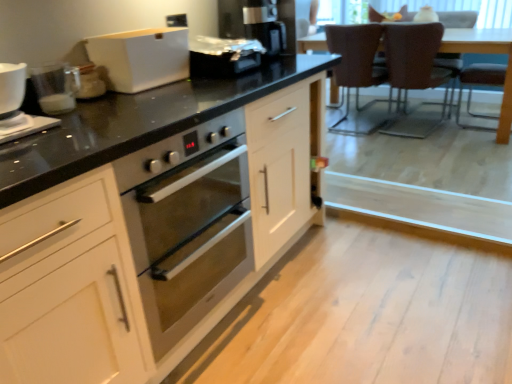
Question: Is brown leather armchair at right, placed as the 1th armchair when sorted from front to back, taller than brown leather armchair at upper right, marked as the 1th armchair in a back-to-front arrangement?

Choices:
 (A) yes
 (B) no

Answer: (B)

Question: Is brown leather armchair at right, positioned as the 2th armchair in back-to-front order, facing away from brown leather armchair at upper right, marked as the 1th armchair in a back-to-front arrangement?

Choices:
 (A) no
 (B) yes

Answer: (A)

Question: Is the depth of brown leather armchair at right, positioned as the 2th armchair in back-to-front order, greater than that of brown leather armchair at upper right, which is counted as the second armchair, starting from the front?

Choices:
 (A) no
 (B) yes

Answer: (A)

Question: Could you tell me if brown leather armchair at right, positioned as the 2th armchair in back-to-front order, is turned towards brown leather armchair at upper right, marked as the 1th armchair in a back-to-front arrangement?

Choices:
 (A) yes
 (B) no

Answer: (A)

Question: From a real-world perspective, is brown leather armchair at right, placed as the 1th armchair when sorted from front to back, beneath brown leather armchair at upper right, marked as the 1th armchair in a back-to-front arrangement?

Choices:
 (A) no
 (B) yes

Answer: (B)

Question: Looking at the image, does brown leather armchair at upper right, which is counted as the second armchair, starting from the front, seem bigger or smaller compared to satin black coffee machine at upper center?

Choices:
 (A) small
 (B) big

Answer: (B)

Question: Is brown leather armchair at upper right, which is counted as the second armchair, starting from the front, taller or shorter than satin black coffee machine at upper center?

Choices:
 (A) short
 (B) tall

Answer: (B)

Question: Is brown leather armchair at upper right, which is counted as the second armchair, starting from the front, in front of or behind satin black coffee machine at upper center in the image?

Choices:
 (A) behind
 (B) front

Answer: (A)

Question: From the image's perspective, is brown leather armchair at upper right, marked as the 1th armchair in a back-to-front arrangement, above or below satin black coffee machine at upper center?

Choices:
 (A) above
 (B) below

Answer: (A)

Question: Considering the positions of white matte cabinet at center and brown leather chair at upper right, which is counted as the 2th chair, starting from the right, in the image, is white matte cabinet at center wider or thinner than brown leather chair at upper right, which is counted as the 2th chair, starting from the right,?

Choices:
 (A) wide
 (B) thin

Answer: (A)

Question: From a real-world perspective, is white matte cabinet at center positioned above or below brown leather chair at upper right, which is counted as the 2th chair, starting from the right?

Choices:
 (A) below
 (B) above

Answer: (A)

Question: Is white matte cabinet at center to the left or to the right of brown leather chair at upper right, marked as the 1th chair in a left-to-right arrangement, in the image?

Choices:
 (A) right
 (B) left

Answer: (B)

Question: In terms of size, does white matte cabinet at center appear bigger or smaller than brown leather chair at upper right, marked as the 1th chair in a left-to-right arrangement?

Choices:
 (A) big
 (B) small

Answer: (A)

Question: Considering the positions of brown leather armchair at upper right, which is counted as the second armchair, starting from the front, and brown leather armchair at right, placed as the 1th armchair when sorted from front to back, in the image, is brown leather armchair at upper right, which is counted as the second armchair, starting from the front, wider or thinner than brown leather armchair at right, placed as the 1th armchair when sorted from front to back,?

Choices:
 (A) thin
 (B) wide

Answer: (B)

Question: From a real-world perspective, relative to brown leather armchair at right, placed as the 1th armchair when sorted from front to back, is brown leather armchair at upper right, marked as the 1th armchair in a back-to-front arrangement, vertically above or below?

Choices:
 (A) above
 (B) below

Answer: (A)